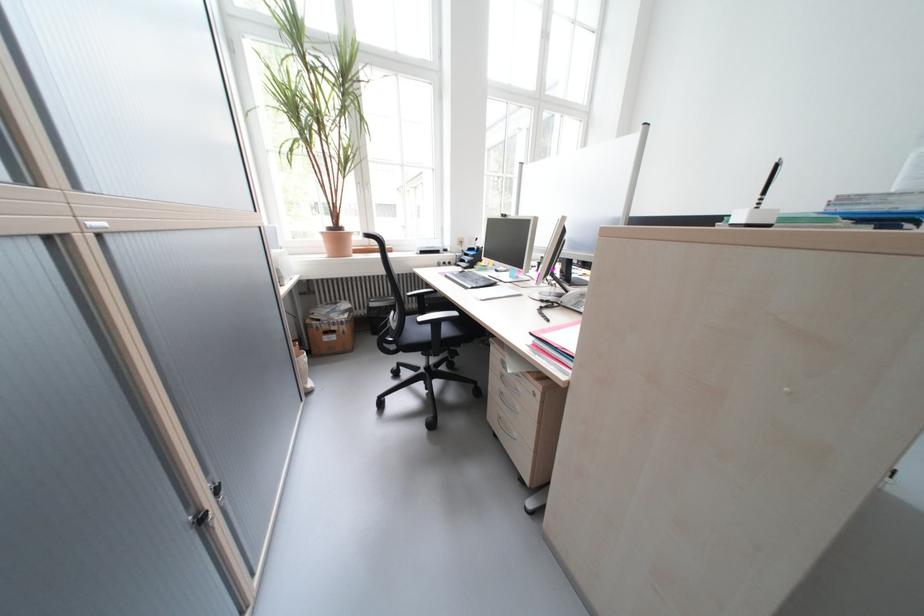
Where would you sit the chair sitting surface? Please return your answer as a coordinate pair (x, y).

(415, 333)